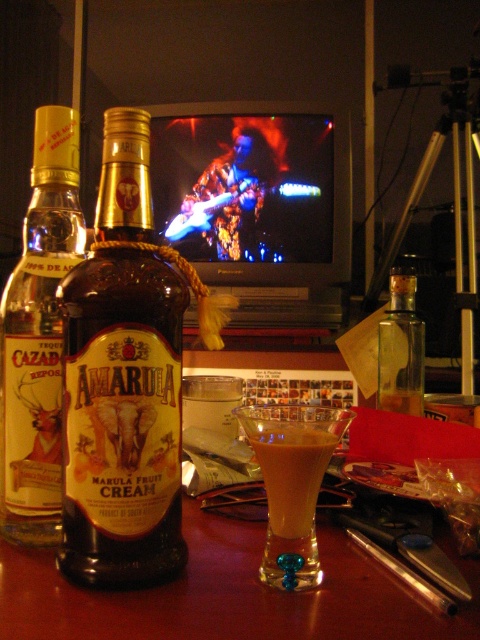
Question: Can you confirm if amber glass bottle at center is bigger than clear glass bottle at center?

Choices:
 (A) yes
 (B) no

Answer: (A)

Question: Among these objects, which one is nearest to the camera?

Choices:
 (A) translucent amber glass bottle at center-left
 (B) amber glass bottle at center
 (C) clear glass bottle at center
 (D) golden creamy cocktail at center

Answer: (D)

Question: Among these objects, which one is farthest from the camera?

Choices:
 (A) amber glass bottle at center
 (B) clear glass bottle at center
 (C) translucent amber glass bottle at center-left
 (D) golden creamy cocktail at center

Answer: (B)

Question: Which point is closer to the camera?

Choices:
 (A) (298, 452)
 (B) (412, 268)

Answer: (A)

Question: Is amber glass bottle at center above translucent amber glass bottle at center-left?

Choices:
 (A) yes
 (B) no

Answer: (B)

Question: Does amber glass bottle at center lie in front of golden creamy cocktail at center?

Choices:
 (A) no
 (B) yes

Answer: (A)